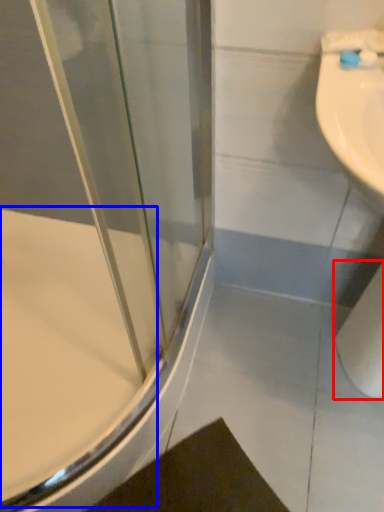
Question: Which object appears farthest to the camera in this image, toilet paper (highlighted by a red box) or bath (highlighted by a blue box)?

Choices:
 (A) toilet paper
 (B) bath

Answer: (B)